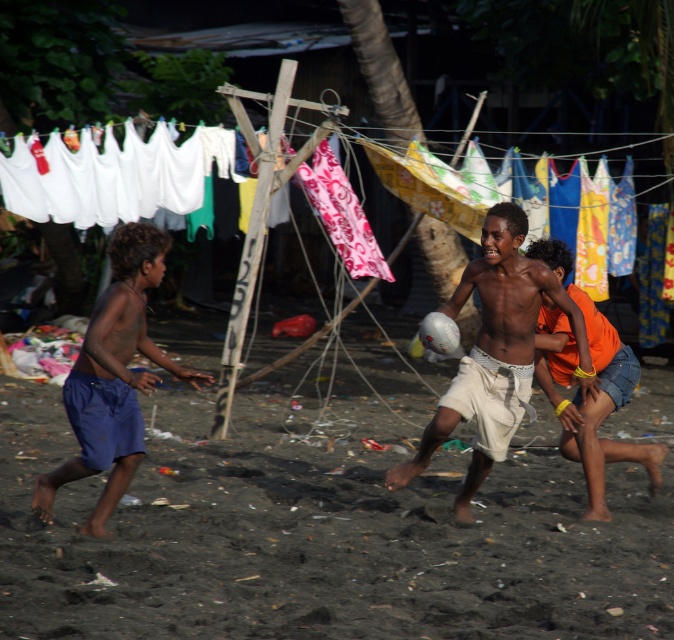
Where is the white cotton shorts at center located in the image?

The white cotton shorts at center is located at point 0.552 on the x axis and 0.733 on the y axis.